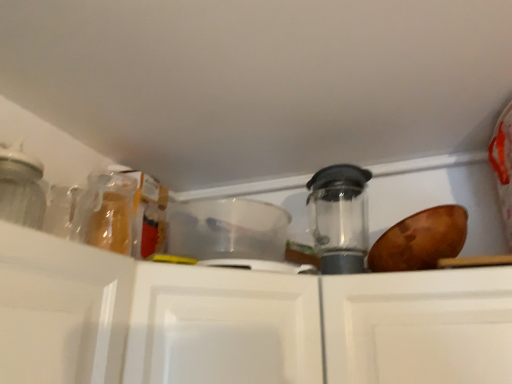
Question: From a real-world perspective, is white matte cabinet at center physically above transparent plastic blender at center, positioned as the 1th appliance in right-to-left order?

Choices:
 (A) yes
 (B) no

Answer: (B)

Question: Is white matte cabinet at center looking in the opposite direction of transparent plastic blender at center, arranged as the second appliance when viewed from the left?

Choices:
 (A) no
 (B) yes

Answer: (A)

Question: Does white matte cabinet at center have a lesser height compared to transparent plastic blender at center, arranged as the second appliance when viewed from the left?

Choices:
 (A) yes
 (B) no

Answer: (B)

Question: From a real-world perspective, is white matte cabinet at center positioned under transparent plastic blender at center, positioned as the 1th appliance in right-to-left order, based on gravity?

Choices:
 (A) no
 (B) yes

Answer: (B)

Question: Is white matte cabinet at center facing towards transparent plastic blender at center, positioned as the 1th appliance in right-to-left order?

Choices:
 (A) no
 (B) yes

Answer: (A)

Question: From the image's perspective, would you say white matte cabinet at center is shown under transparent plastic blender at center, positioned as the 1th appliance in right-to-left order?

Choices:
 (A) yes
 (B) no

Answer: (A)

Question: Is transparent plastic blender at center, arranged as the second appliance when viewed from the left, positioned beyond the bounds of transparent plastic container at center, placed as the first appliance when sorted from left to right?

Choices:
 (A) yes
 (B) no

Answer: (A)

Question: From a real-world perspective, is transparent plastic blender at center, arranged as the second appliance when viewed from the left, positioned over transparent plastic container at center, placed as the first appliance when sorted from left to right, based on gravity?

Choices:
 (A) yes
 (B) no

Answer: (A)

Question: From the image's perspective, is transparent plastic blender at center, positioned as the 1th appliance in right-to-left order, on top of transparent plastic container at center, placed as the 2th appliance when sorted from right to left?

Choices:
 (A) no
 (B) yes

Answer: (B)

Question: Does transparent plastic blender at center, positioned as the 1th appliance in right-to-left order, have a smaller size compared to transparent plastic container at center, placed as the 2th appliance when sorted from right to left?

Choices:
 (A) yes
 (B) no

Answer: (B)

Question: Is transparent plastic blender at center, positioned as the 1th appliance in right-to-left order, thinner than transparent plastic container at center, placed as the first appliance when sorted from left to right?

Choices:
 (A) yes
 (B) no

Answer: (A)

Question: Does transparent plastic blender at center, arranged as the second appliance when viewed from the left, have a greater height compared to transparent plastic container at center, placed as the first appliance when sorted from left to right?

Choices:
 (A) yes
 (B) no

Answer: (A)

Question: From a real-world perspective, is white matte cabinet at center beneath transparent plastic container at center, placed as the first appliance when sorted from left to right?

Choices:
 (A) no
 (B) yes

Answer: (B)